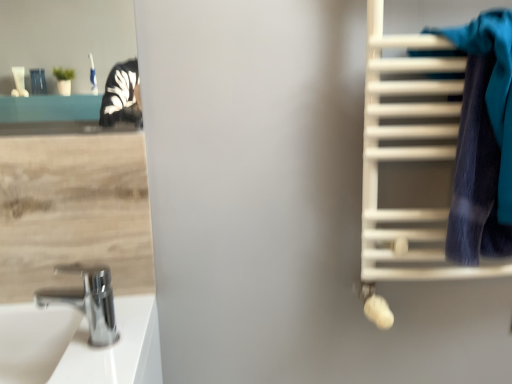
You are a GUI agent. You are given a task and a screenshot of the screen. Output one action in this format:
    pyautogui.click(x=<x>, y=<y>)
    Task: Click on the white glossy sink at lower left
    Image resolution: width=512 pixels, height=384 pixels.
    Given the screenshot: What is the action you would take?
    pyautogui.click(x=34, y=340)

Where is `white glossy sink at lower left`? This screenshot has height=384, width=512. white glossy sink at lower left is located at coordinates (34, 340).

Is white glossy sink at lower left aimed at white matte towel rack at right?

No, white glossy sink at lower left is not turned towards white matte towel rack at right.

Considering the sizes of objects white glossy sink at lower left and white matte towel rack at right in the image provided, who is taller, white glossy sink at lower left or white matte towel rack at right?

Standing taller between the two is white matte towel rack at right.

Is white glossy sink at lower left not near white matte towel rack at right?

That's not correct — white glossy sink at lower left is a little close to white matte towel rack at right.

Which object is closer to the camera taking this photo, white glossy sink at lower left or white matte towel rack at right?

Positioned in front is white glossy sink at lower left.

Are blue fabric towel at right and chrome metallic faucet at lower left far apart?

blue fabric towel at right is actually quite close to chrome metallic faucet at lower left.

Is blue fabric towel at right facing towards chrome metallic faucet at lower left?

No, blue fabric towel at right does not turn towards chrome metallic faucet at lower left.

Between blue fabric towel at right and chrome metallic faucet at lower left, which one has more height?

blue fabric towel at right.

From a real-world perspective, between blue fabric towel at right and chrome metallic faucet at lower left, who is vertically lower?

chrome metallic faucet at lower left is physically lower.

Are blue fabric towel at right and white matte towel rack at right located far from each other?

No, there isn't a large distance between blue fabric towel at right and white matte towel rack at right.

Does blue fabric towel at right have a larger size compared to white matte towel rack at right?

No, blue fabric towel at right is not bigger than white matte towel rack at right.

From a real-world perspective, which is physically below, blue fabric towel at right or white matte towel rack at right?

white matte towel rack at right is physically lower.

Looking at the image, does white glossy sink at lower left seem bigger or smaller compared to blue fabric towel at right?

Clearly, white glossy sink at lower left is smaller in size than blue fabric towel at right.

Is white glossy sink at lower left in contact with blue fabric towel at right?

white glossy sink at lower left and blue fabric towel at right are not in contact.

Which of these two, white glossy sink at lower left or blue fabric towel at right, stands taller?

Standing taller between the two is blue fabric towel at right.

Can you tell me how much white glossy sink at lower left and blue fabric towel at right differ in facing direction?

1.26 degrees.

Looking at this image, from a real-world perspective, between white matte towel rack at right and blue fabric towel at right, who is vertically higher?

blue fabric towel at right, from a real-world perspective.

Which object is thinner, white matte towel rack at right or blue fabric towel at right?

Answer: blue fabric towel at right.

Locate an element on the screen. This screenshot has height=384, width=512. bunk bed that is below the blue fabric towel at right (from the image's perspective) is located at coordinates (404, 160).

From a real-world perspective, is white matte towel rack at right over chrome metallic faucet at lower left?

Yes, from a real-world perspective, white matte towel rack at right is over chrome metallic faucet at lower left

Between white matte towel rack at right and chrome metallic faucet at lower left, which one has smaller width?

chrome metallic faucet at lower left.

The image size is (512, 384). Find the location of `tap below the white matte towel rack at right (from the image's perspective)`. tap below the white matte towel rack at right (from the image's perspective) is located at coordinates (88, 301).

Is white matte towel rack at right oriented towards white glossy sink at lower left?

No, white matte towel rack at right is not facing towards white glossy sink at lower left.

Is point (424, 274) farther from camera compared to point (9, 347)?

No, (424, 274) is closer to viewer.

Considering the positions of objects white matte towel rack at right and white glossy sink at lower left in the image provided, who is more to the left, white matte towel rack at right or white glossy sink at lower left?

Positioned to the left is white glossy sink at lower left.

From a real-world perspective, is white matte towel rack at right physically located above or below white glossy sink at lower left?

In terms of real-world spatial position, white matte towel rack at right is above white glossy sink at lower left.

The width and height of the screenshot is (512, 384). In the image, there is a white matte towel rack at right. In order to click on sink below it (from the image's perspective) in this screenshot , I will do `click(34, 340)`.

Identify the location of tap below the blue fabric towel at right (from a real-world perspective). Image resolution: width=512 pixels, height=384 pixels. (88, 301).

From the image, which object appears to be nearer to chrome metallic faucet at lower left, white matte towel rack at right or blue fabric towel at right?

white matte towel rack at right lies closer to chrome metallic faucet at lower left than the other object.

Based on their spatial positions, is chrome metallic faucet at lower left or white matte towel rack at right closer to white glossy sink at lower left?

Among the two, chrome metallic faucet at lower left is located nearer to white glossy sink at lower left.

Based on their spatial positions, is chrome metallic faucet at lower left or blue fabric towel at right closer to white matte towel rack at right?

blue fabric towel at right is closer to white matte towel rack at right.

Looking at the image, which one is located further to chrome metallic faucet at lower left, blue fabric towel at right or white matte towel rack at right?

blue fabric towel at right.

From the picture: Estimate the real-world distances between objects in this image. Which object is further from blue fabric towel at right, white matte towel rack at right or white glossy sink at lower left?

The object further to blue fabric towel at right is white glossy sink at lower left.

Which object lies nearer to the anchor point blue fabric towel at right, white matte towel rack at right or chrome metallic faucet at lower left?

white matte towel rack at right.

Based on their spatial positions, is white glossy sink at lower left or white matte towel rack at right closer to blue fabric towel at right?

The object closer to blue fabric towel at right is white matte towel rack at right.

Looking at the image, which one is located closer to chrome metallic faucet at lower left, white glossy sink at lower left or white matte towel rack at right?

Among the two, white glossy sink at lower left is located nearer to chrome metallic faucet at lower left.

Locate an element on the screen. Image resolution: width=512 pixels, height=384 pixels. bath towel between white glossy sink at lower left and white matte towel rack at right is located at coordinates (482, 140).

The height and width of the screenshot is (384, 512). I want to click on bath towel between chrome metallic faucet at lower left and white matte towel rack at right in the horizontal direction, so click(x=482, y=140).

Where is `tap situated between white glossy sink at lower left and white matte towel rack at right from left to right`? tap situated between white glossy sink at lower left and white matte towel rack at right from left to right is located at coordinates (88, 301).

Locate an element on the screen. The image size is (512, 384). tap located between white glossy sink at lower left and blue fabric towel at right in the left-right direction is located at coordinates (88, 301).